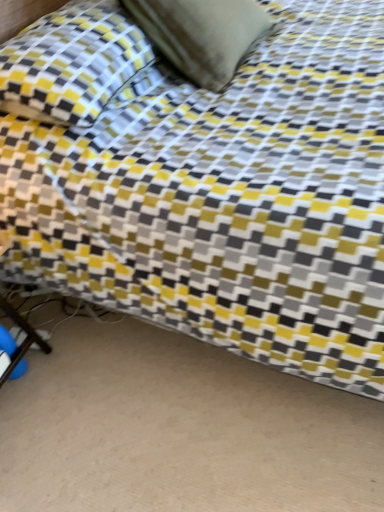
Question: Is suede-like beige pillow at upper center, marked as the second pillow in a left-to-right arrangement, to the right of yellow fabric pillow at upper left, the 1th pillow when ordered from left to right, from the viewer's perspective?

Choices:
 (A) no
 (B) yes

Answer: (B)

Question: Is suede-like beige pillow at upper center, marked as the second pillow in a left-to-right arrangement, bigger than yellow fabric pillow at upper left, the second pillow in the right-to-left sequence?

Choices:
 (A) no
 (B) yes

Answer: (A)

Question: From a real-world perspective, is suede-like beige pillow at upper center, marked as the second pillow in a left-to-right arrangement, on yellow fabric pillow at upper left, the second pillow in the right-to-left sequence?

Choices:
 (A) yes
 (B) no

Answer: (A)

Question: Is suede-like beige pillow at upper center, the first pillow viewed from the right, wider than yellow fabric pillow at upper left, the 1th pillow when ordered from left to right?

Choices:
 (A) yes
 (B) no

Answer: (B)

Question: Does suede-like beige pillow at upper center, marked as the second pillow in a left-to-right arrangement, turn towards yellow fabric pillow at upper left, the 1th pillow when ordered from left to right?

Choices:
 (A) yes
 (B) no

Answer: (B)

Question: Would you say suede-like beige pillow at upper center, the first pillow viewed from the right, contains yellow fabric pillow at upper left, the second pillow in the right-to-left sequence?

Choices:
 (A) yes
 (B) no

Answer: (B)

Question: Considering the relative sizes of yellow fabric pillow at upper left, the second pillow in the right-to-left sequence, and suede-like beige pillow at upper center, the first pillow viewed from the right, in the image provided, is yellow fabric pillow at upper left, the second pillow in the right-to-left sequence, bigger than suede-like beige pillow at upper center, the first pillow viewed from the right,?

Choices:
 (A) yes
 (B) no

Answer: (A)

Question: Is yellow fabric pillow at upper left, the second pillow in the right-to-left sequence, beside suede-like beige pillow at upper center, marked as the second pillow in a left-to-right arrangement?

Choices:
 (A) no
 (B) yes

Answer: (A)

Question: Considering the relative positions of yellow fabric pillow at upper left, the 1th pillow when ordered from left to right, and suede-like beige pillow at upper center, the first pillow viewed from the right, in the image provided, is yellow fabric pillow at upper left, the 1th pillow when ordered from left to right, to the right of suede-like beige pillow at upper center, the first pillow viewed from the right, from the viewer's perspective?

Choices:
 (A) no
 (B) yes

Answer: (A)

Question: Is yellow fabric pillow at upper left, the 1th pillow when ordered from left to right, facing away from suede-like beige pillow at upper center, marked as the second pillow in a left-to-right arrangement?

Choices:
 (A) no
 (B) yes

Answer: (A)

Question: Is yellow fabric pillow at upper left, the 1th pillow when ordered from left to right, positioned in front of suede-like beige pillow at upper center, marked as the second pillow in a left-to-right arrangement?

Choices:
 (A) yes
 (B) no

Answer: (A)

Question: Is yellow fabric pillow at upper left, the second pillow in the right-to-left sequence, located outside suede-like beige pillow at upper center, the first pillow viewed from the right?

Choices:
 (A) yes
 (B) no

Answer: (A)

Question: Is point (258, 28) positioned closer to the camera than point (127, 34)?

Choices:
 (A) farther
 (B) closer

Answer: (A)